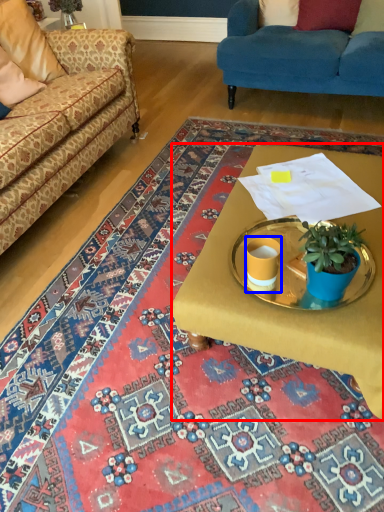
Question: Which point is further to the camera, desk (highlighted by a red box) or coffee cup (highlighted by a blue box)?

Choices:
 (A) desk
 (B) coffee cup

Answer: (B)